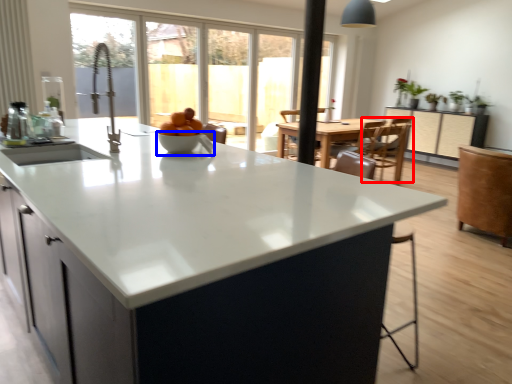
Question: Which point is closer to the camera, armchair (highlighted by a red box) or bowl (highlighted by a blue box)?

Choices:
 (A) armchair
 (B) bowl

Answer: (B)